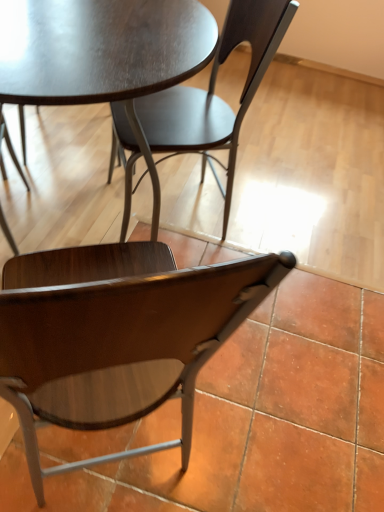
Question: Is matte dark wood table at center positioned beyond the bounds of wooden chair at lower center, which ranks as the 1th chair in bottom-to-top order?

Choices:
 (A) no
 (B) yes

Answer: (B)

Question: From the image's perspective, is matte dark wood table at center over wooden chair at lower center, which ranks as the 1th chair in bottom-to-top order?

Choices:
 (A) no
 (B) yes

Answer: (B)

Question: Considering the relative sizes of matte dark wood table at center and wooden chair at lower center, which ranks as the 1th chair in bottom-to-top order, in the image provided, is matte dark wood table at center thinner than wooden chair at lower center, which ranks as the 1th chair in bottom-to-top order,?

Choices:
 (A) no
 (B) yes

Answer: (A)

Question: Is matte dark wood table at center wider than wooden chair at lower center, which ranks as the 1th chair in bottom-to-top order?

Choices:
 (A) no
 (B) yes

Answer: (B)

Question: From the image's perspective, would you say matte dark wood table at center is shown under wooden chair at lower center, which ranks as the 1th chair in bottom-to-top order?

Choices:
 (A) no
 (B) yes

Answer: (A)

Question: Can you confirm if matte dark wood table at center is bigger than wooden chair at lower center, the second chair in the top-to-bottom sequence?

Choices:
 (A) no
 (B) yes

Answer: (B)

Question: Does matte dark wood chair at center, the 2th chair ordered from the bottom, turn towards matte dark wood table at center?

Choices:
 (A) yes
 (B) no

Answer: (A)

Question: Is matte dark wood chair at center, the 2th chair ordered from the bottom, smaller than matte dark wood table at center?

Choices:
 (A) yes
 (B) no

Answer: (A)

Question: Does matte dark wood chair at center, which is the 1th chair from top to bottom, lie behind matte dark wood table at center?

Choices:
 (A) no
 (B) yes

Answer: (B)

Question: Is matte dark wood chair at center, which is the 1th chair from top to bottom, closer to the viewer compared to matte dark wood table at center?

Choices:
 (A) yes
 (B) no

Answer: (B)

Question: From a real-world perspective, does matte dark wood chair at center, the 2th chair ordered from the bottom, stand above matte dark wood table at center?

Choices:
 (A) no
 (B) yes

Answer: (B)

Question: Is matte dark wood table at center at the back of matte dark wood chair at center, the 2th chair ordered from the bottom?

Choices:
 (A) no
 (B) yes

Answer: (B)

Question: Considering the relative positions of matte dark wood chair at center, which is the 1th chair from top to bottom, and wooden chair at lower center, the second chair in the top-to-bottom sequence, in the image provided, is matte dark wood chair at center, which is the 1th chair from top to bottom, to the right of wooden chair at lower center, the second chair in the top-to-bottom sequence, from the viewer's perspective?

Choices:
 (A) no
 (B) yes

Answer: (B)